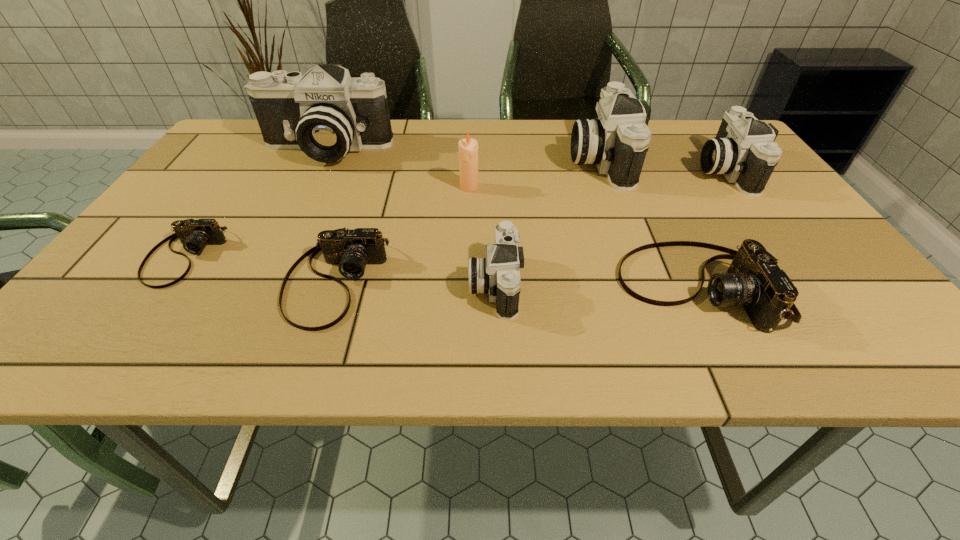
Find the location of a particular element. This screenshot has height=540, width=960. free space at the left edge is located at coordinates (202, 167).

Where is `vacant position at the far left corner of the desktop`? vacant position at the far left corner of the desktop is located at coordinates (231, 129).

Where is `vacant point located between the third black camera from right to left and the third black camera from left to right`? vacant point located between the third black camera from right to left and the third black camera from left to right is located at coordinates (547, 221).

Where is `vacant space in between the seventh shortest object and the biggest brown camera`? The image size is (960, 540). vacant space in between the seventh shortest object and the biggest brown camera is located at coordinates (650, 223).

The height and width of the screenshot is (540, 960). Identify the location of free spot between the biggest brown camera and the third biggest black camera. (711, 228).

I want to click on vacant area between the second smallest black camera and the rightmost brown camera, so click(x=711, y=228).

You are a GUI agent. You are given a task and a screenshot of the screen. Output one action in this format:
    pyautogui.click(x=<x>, y=<y>)
    Task: Click on the unoccupied area between the fifth shortest camera and the shortest object
    
    Given the screenshot: What is the action you would take?
    pyautogui.click(x=454, y=213)

Locate an element on the screen. The image size is (960, 540). vacant region between the nearest black camera and the candle is located at coordinates (482, 235).

The image size is (960, 540). In order to click on free space between the nearest black camera and the tallest camera in this screenshot , I will do `click(410, 217)`.

Locate an element on the screen. This screenshot has width=960, height=540. vacant region between the candle and the leftmost brown camera is located at coordinates (326, 222).